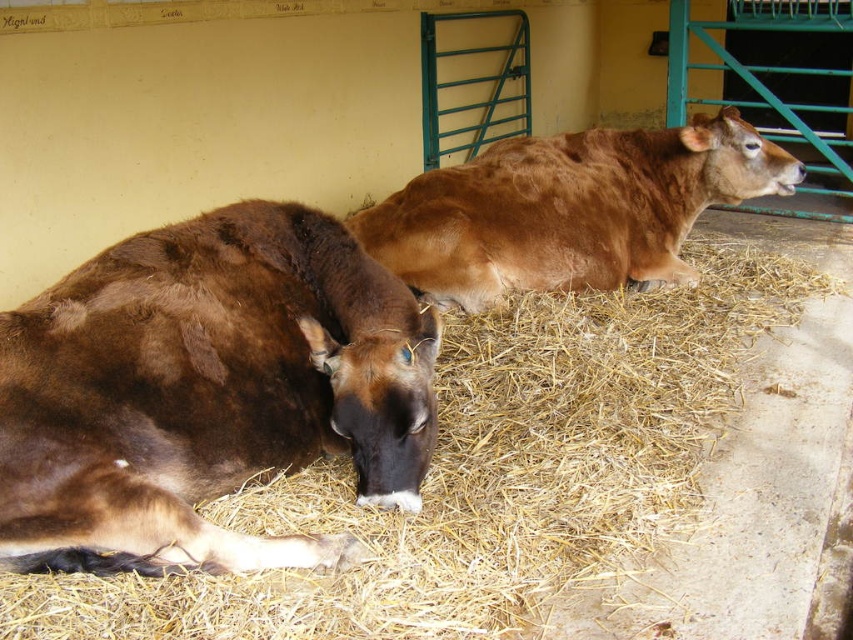
Question: Can you confirm if brown straw at center is positioned below brown matte cow at lower left?

Choices:
 (A) yes
 (B) no

Answer: (A)

Question: Is brown straw at center positioned in front of brown smooth cow at center?

Choices:
 (A) no
 (B) yes

Answer: (B)

Question: Among these objects, which one is farthest from the camera?

Choices:
 (A) brown smooth cow at center
 (B) brown matte cow at lower left
 (C) brown straw at center

Answer: (A)

Question: Which object is closer to the camera taking this photo?

Choices:
 (A) brown matte cow at lower left
 (B) brown straw at center
 (C) brown smooth cow at center

Answer: (B)

Question: Does brown straw at center appear over brown smooth cow at center?

Choices:
 (A) no
 (B) yes

Answer: (A)

Question: Based on their relative distances, which object is farther from the brown smooth cow at center?

Choices:
 (A) brown matte cow at lower left
 (B) brown straw at center

Answer: (A)